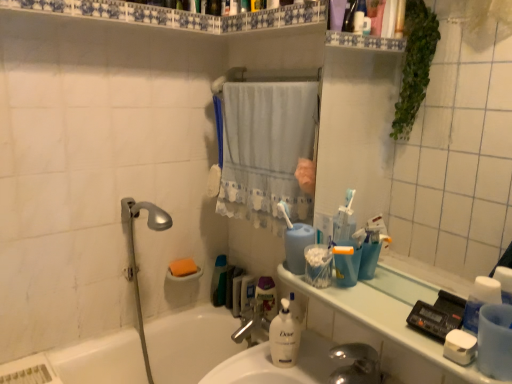
Question: From the image's perspective, is transparent plastic mirror at upper right over translucent plastic mouthwash at center?

Choices:
 (A) no
 (B) yes

Answer: (B)

Question: Does transparent plastic mirror at upper right have a lesser height compared to translucent plastic mouthwash at center?

Choices:
 (A) no
 (B) yes

Answer: (A)

Question: Could you tell me if transparent plastic mirror at upper right is facing translucent plastic mouthwash at center?

Choices:
 (A) no
 (B) yes

Answer: (A)

Question: Does transparent plastic mirror at upper right come behind translucent plastic mouthwash at center?

Choices:
 (A) yes
 (B) no

Answer: (B)

Question: Is translucent plastic mouthwash at center completely or partially inside transparent plastic mirror at upper right?

Choices:
 (A) no
 (B) yes

Answer: (A)

Question: Does transparent plastic mirror at upper right have a larger size compared to translucent plastic mouthwash at center?

Choices:
 (A) yes
 (B) no

Answer: (A)

Question: Is white glossy shelf at upper center at the left side of white lace curtain at center?

Choices:
 (A) yes
 (B) no

Answer: (A)

Question: Considering the relative sizes of white glossy shelf at upper center and white lace curtain at center in the image provided, is white glossy shelf at upper center thinner than white lace curtain at center?

Choices:
 (A) no
 (B) yes

Answer: (A)

Question: Is white glossy shelf at upper center positioned beyond the bounds of white lace curtain at center?

Choices:
 (A) yes
 (B) no

Answer: (A)

Question: Are white glossy shelf at upper center and white lace curtain at center making contact?

Choices:
 (A) yes
 (B) no

Answer: (B)

Question: Is white glossy shelf at upper center to the right of white lace curtain at center from the viewer's perspective?

Choices:
 (A) no
 (B) yes

Answer: (A)

Question: Is white glossy shelf at upper center further to camera compared to white lace curtain at center?

Choices:
 (A) no
 (B) yes

Answer: (A)

Question: From a real-world perspective, is orange sponge at lower left, which appears as the 2th soap when viewed from the right, over white plastic toothbrush at center?

Choices:
 (A) no
 (B) yes

Answer: (A)